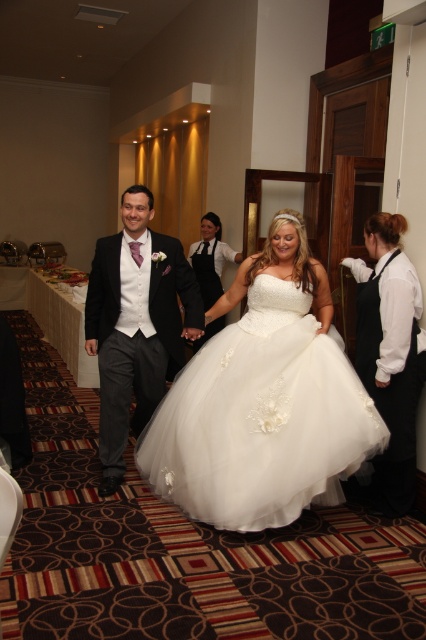
You are a photographer at the wedding reception. You want to capture a photo of the matte black suit at center and the white satin dress at center. Which one is positioned to the left side of the other?

The matte black suit at center is to the left of the white satin dress at center.

You are a photographer positioned at the back of the aisle. You need to ensure both the matte black suit at center and the white satin dress at center are fully visible in your shot. Given that your camera has a fixed focal length, which subject should you prioritize focusing on to ensure the larger one is in focus first?

The matte black suit at center is bigger than the white satin dress at center, so you should prioritize focusing on the matte black suit at center first to ensure it is in focus since it occupies more space in the frame.

You are a photographer at the wedding reception and need to capture a photo of both the white satin dress at right and the white satin dress at center. Which dress should you focus on first to ensure it appears larger in the photo?

The white satin dress at right is much taller than the white satin dress at center, so focusing on it first will ensure it appears larger in the photo.